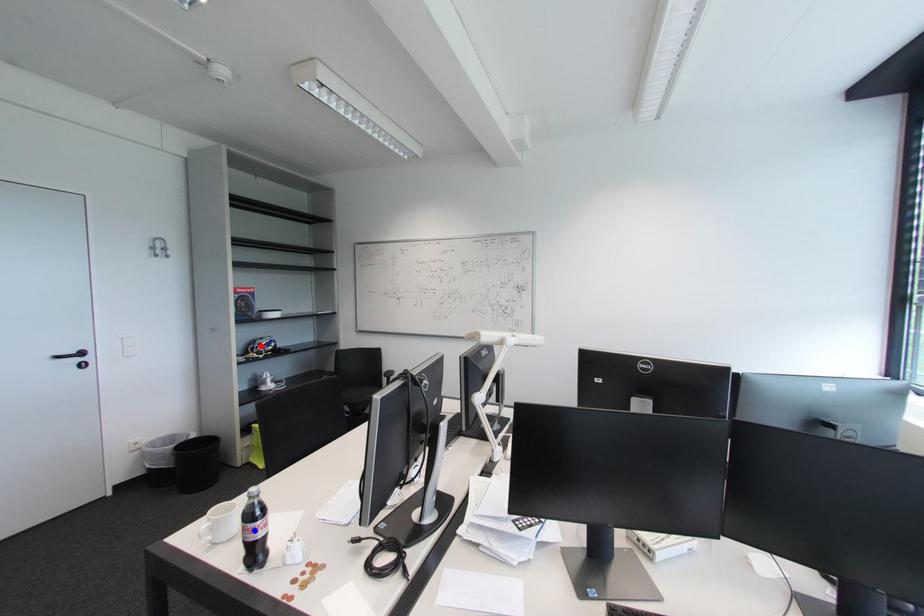
Question: In the image, two points are highlighted. Which point is nearer to the camera? Reply with the corresponding letter.

Choices:
 (A) blue point
 (B) red point

Answer: (A)